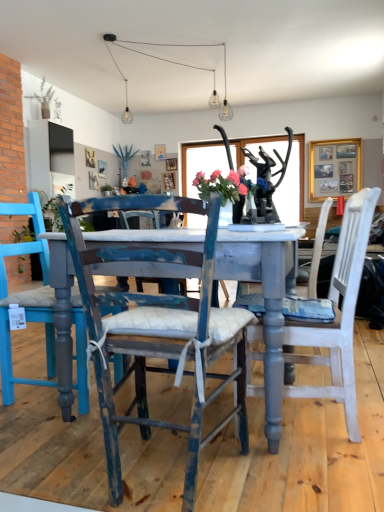
Question: Considering the relative positions of pink fabric flowers at center and white painted wood chair at center, which is counted as the second chair, starting from the left, in the image provided, is pink fabric flowers at center in front of white painted wood chair at center, which is counted as the second chair, starting from the left,?

Choices:
 (A) yes
 (B) no

Answer: (B)

Question: From the image's perspective, would you say pink fabric flowers at center is positioned over white painted wood chair at center, which appears as the 1th chair when viewed from the right?

Choices:
 (A) no
 (B) yes

Answer: (B)

Question: Is pink fabric flowers at center far away from white painted wood chair at center, which appears as the 1th chair when viewed from the right?

Choices:
 (A) no
 (B) yes

Answer: (A)

Question: Can you confirm if pink fabric flowers at center is thinner than white painted wood chair at center, which appears as the 1th chair when viewed from the right?

Choices:
 (A) yes
 (B) no

Answer: (A)

Question: Does pink fabric flowers at center have a larger size compared to white painted wood chair at center, which is counted as the second chair, starting from the left?

Choices:
 (A) no
 (B) yes

Answer: (A)

Question: Is pink fabric flowers at center wider than white painted wood chair at center, which appears as the 1th chair when viewed from the right?

Choices:
 (A) yes
 (B) no

Answer: (B)

Question: Is green leafy plant at upper center, acting as the 1th plant starting from the back, beside pink fabric flowers at center?

Choices:
 (A) yes
 (B) no

Answer: (B)

Question: Does green leafy plant at upper center, which ranks as the second plant in left-to-right order, appear on the left side of pink fabric flowers at center?

Choices:
 (A) yes
 (B) no

Answer: (A)

Question: Is green leafy plant at upper center, positioned as the second plant in front-to-back order, far away from pink fabric flowers at center?

Choices:
 (A) no
 (B) yes

Answer: (B)

Question: Is green leafy plant at upper center, which is the 1th plant from right to left, thinner than pink fabric flowers at center?

Choices:
 (A) no
 (B) yes

Answer: (A)

Question: Considering the relative sizes of green leafy plant at upper center, which ranks as the second plant in left-to-right order, and pink fabric flowers at center in the image provided, is green leafy plant at upper center, which ranks as the second plant in left-to-right order, shorter than pink fabric flowers at center?

Choices:
 (A) no
 (B) yes

Answer: (A)

Question: From a real-world perspective, is green leafy plant at upper center, positioned as the second plant in front-to-back order, positioned over pink fabric flowers at center based on gravity?

Choices:
 (A) no
 (B) yes

Answer: (B)

Question: From the image's perspective, is distressed blue wood chair at center, the first chair in the left-to-right sequence, on white painted wood chair at center, which appears as the 1th chair when viewed from the right?

Choices:
 (A) no
 (B) yes

Answer: (A)